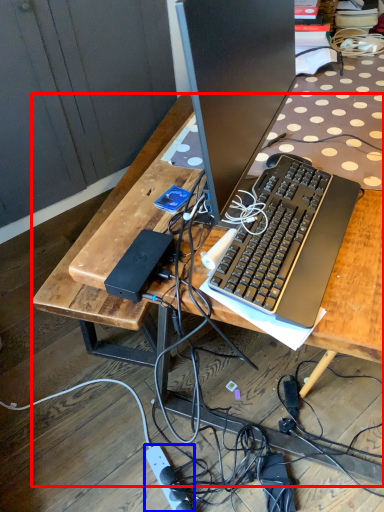
Question: Which object is closer to the camera taking this photo, desk (highlighted by a red box) or power outlet (highlighted by a blue box)?

Choices:
 (A) desk
 (B) power outlet

Answer: (A)